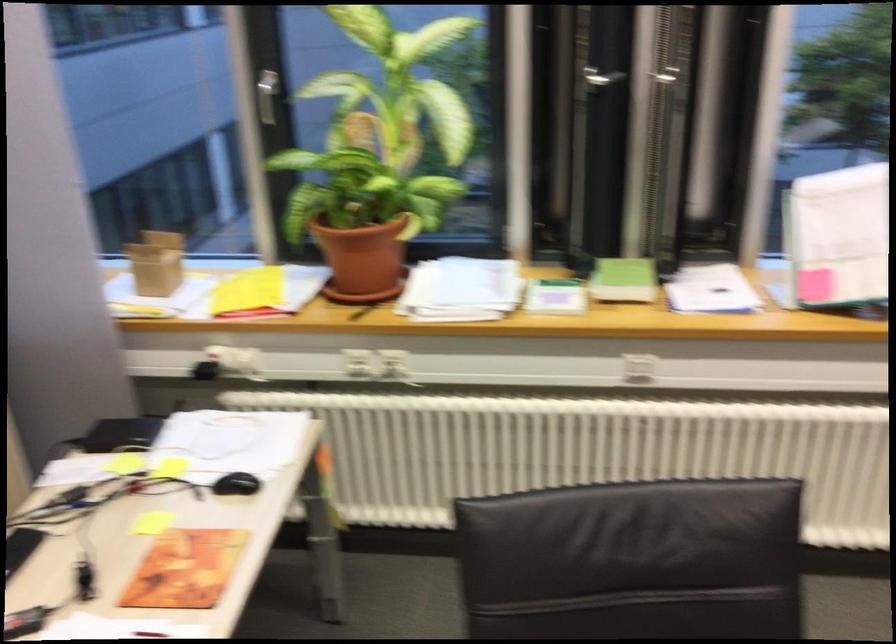
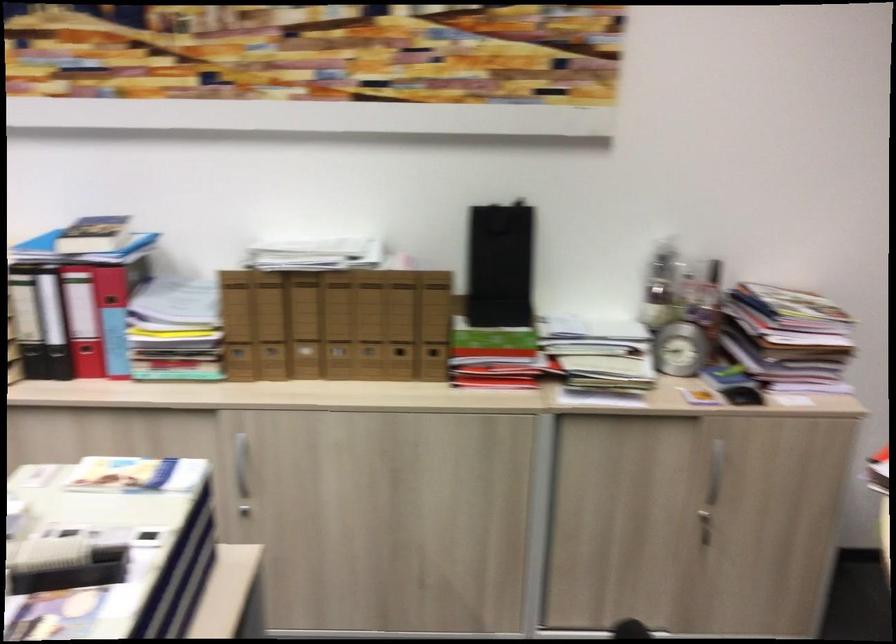
The first image is from the beginning of the video and the second image is from the end. How did the camera likely rotate when shooting the video?

The camera rotated toward right-down.